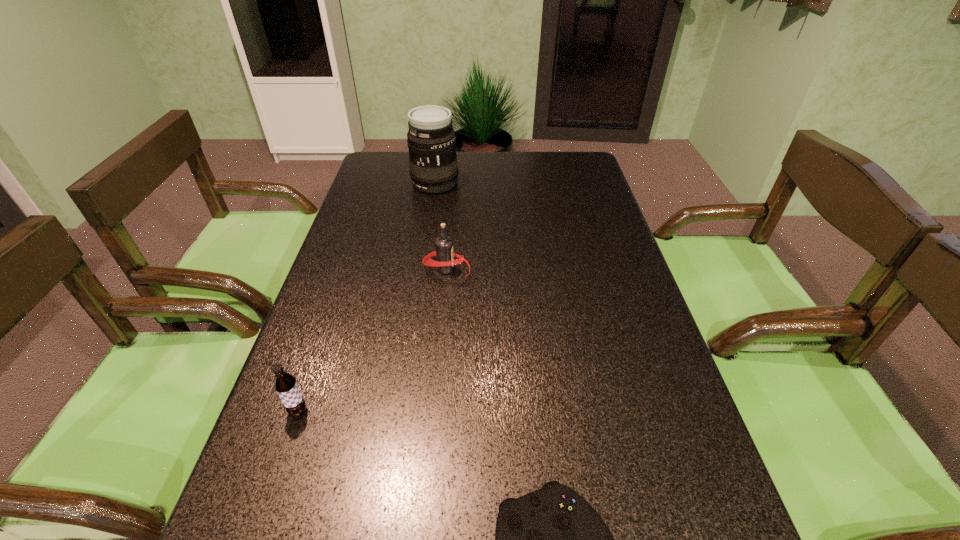
This screenshot has height=540, width=960. Find the location of `telephoto lens located at the left edge`. telephoto lens located at the left edge is located at coordinates (431, 140).

You are a GUI agent. You are given a task and a screenshot of the screen. Output one action in this format:
    pyautogui.click(x=<x>, y=<y>)
    Task: Click on the root beer that is at the left edge
    
    Given the screenshot: What is the action you would take?
    pyautogui.click(x=285, y=384)

At what (x,y) coordinates should I click in order to perform the action: click on object present at the far left corner. Please return your answer as a coordinate pair (x, y). The image size is (960, 540). Looking at the image, I should click on (431, 140).

Where is `free region at the far edge of the desktop`? free region at the far edge of the desktop is located at coordinates (534, 180).

In the image, there is a desktop. What are the coordinates of `vacant space at the left edge` in the screenshot? It's located at (307, 443).

The height and width of the screenshot is (540, 960). In order to click on free region at the right edge of the desktop in this screenshot , I will do `click(569, 206)`.

What are the coordinates of `vacant space at the far left corner` in the screenshot? It's located at (392, 152).

In the image, there is a desktop. Where is `vacant space at the far right corner`? The height and width of the screenshot is (540, 960). vacant space at the far right corner is located at coordinates (554, 173).

I want to click on free space that is in between the nearer root beer and the right root beer, so click(372, 340).

Image resolution: width=960 pixels, height=540 pixels. Find the location of `empty space that is in between the third nearest object and the farthest object`. empty space that is in between the third nearest object and the farthest object is located at coordinates (367, 296).